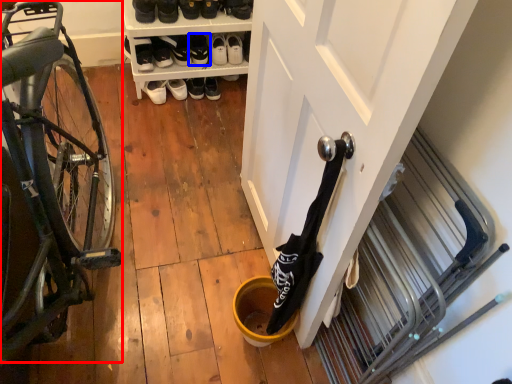
Question: Which object appears farthest to the camera in this image, bicycle (highlighted by a red box) or footwear (highlighted by a blue box)?

Choices:
 (A) bicycle
 (B) footwear

Answer: (B)